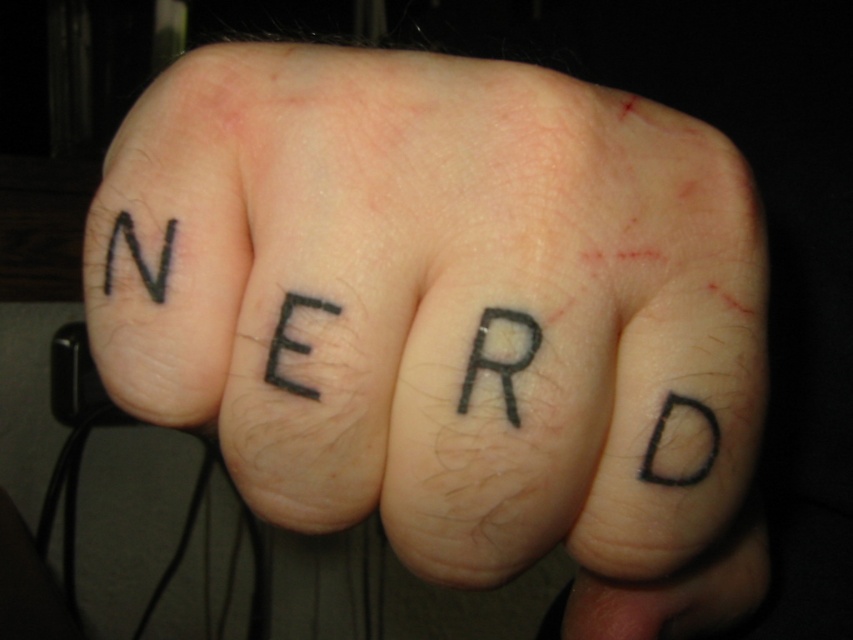
Does black ink tattoo at center appear over black ink letter at upper left?

No, black ink tattoo at center is not above black ink letter at upper left.

This screenshot has width=853, height=640. What do you see at coordinates (451, 316) in the screenshot? I see `black ink tattoo at center` at bounding box center [451, 316].

The height and width of the screenshot is (640, 853). In order to click on black ink tattoo at center in this screenshot , I will do `click(451, 316)`.